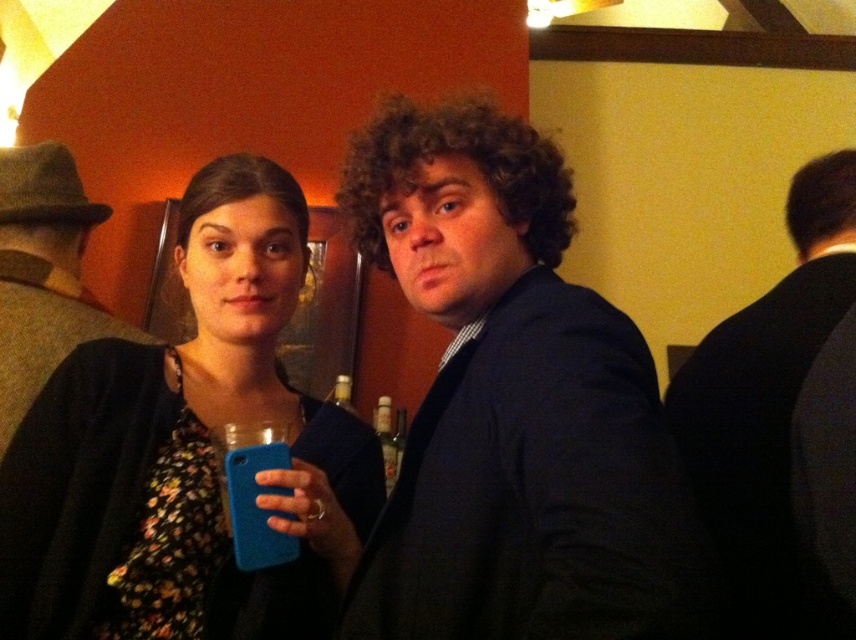
Question: Which of these objects is positioned closest to the dark blue suit at center?

Choices:
 (A) matte blue phone at center
 (B) dark brown wool hat at upper left
 (C) dark blue suit at right

Answer: (A)

Question: Is the position of dark blue suit at center more distant than that of dark blue suit at right?

Choices:
 (A) yes
 (B) no

Answer: (B)

Question: Is dark blue suit at right in front of dark brown wool hat at upper left?

Choices:
 (A) yes
 (B) no

Answer: (A)

Question: Which object is the farthest from the matte blue phone at center?

Choices:
 (A) dark blue suit at center
 (B) dark brown wool hat at upper left
 (C) dark blue suit at right

Answer: (C)

Question: Which is farther from the dark brown wool hat at upper left?

Choices:
 (A) dark blue suit at center
 (B) dark blue suit at right

Answer: (B)

Question: Observing the image, what is the correct spatial positioning of dark blue suit at right in reference to dark brown wool hat at upper left?

Choices:
 (A) below
 (B) above

Answer: (A)